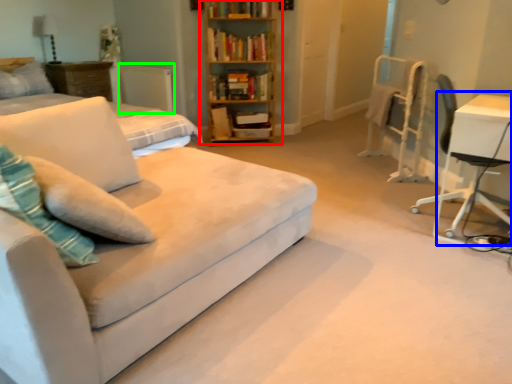
Question: Based on their relative distances, which object is nearer to bookcase (highlighted by a red box)? Choose from table (highlighted by a blue box) and radiator (highlighted by a green box).

Choices:
 (A) table
 (B) radiator

Answer: (B)